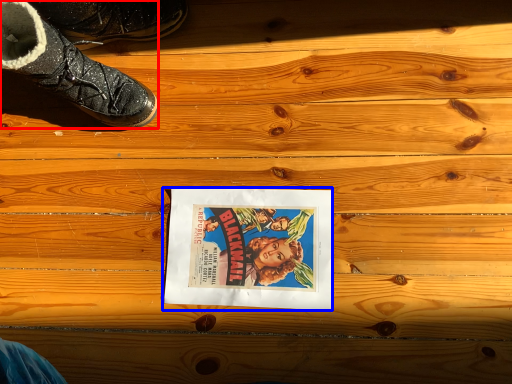
Question: Which of the following is the farthest to the observer, footwear (highlighted by a red box) or movie poster (highlighted by a blue box)?

Choices:
 (A) footwear
 (B) movie poster

Answer: (B)